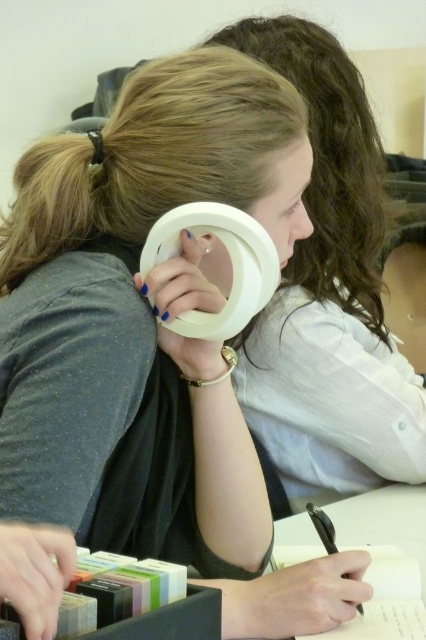
Question: Which object appears farthest from the camera in this image?

Choices:
 (A) white paper at center
 (B) white matte magnifying glass at center

Answer: (B)

Question: Which point is farther to the camera?

Choices:
 (A) (293, 522)
 (B) (382, 209)

Answer: (B)

Question: Is white plastic magnifying glass at upper center thinner than white paper at center?

Choices:
 (A) no
 (B) yes

Answer: (B)

Question: Which object is closer to the camera taking this photo?

Choices:
 (A) white matte magnifying glass at center
 (B) white paper at center

Answer: (B)

Question: Can you confirm if white plastic magnifying glass at upper center is bigger than white paper at center?

Choices:
 (A) no
 (B) yes

Answer: (A)

Question: Can you confirm if white matte magnifying glass at center is bigger than white paper at center?

Choices:
 (A) no
 (B) yes

Answer: (B)